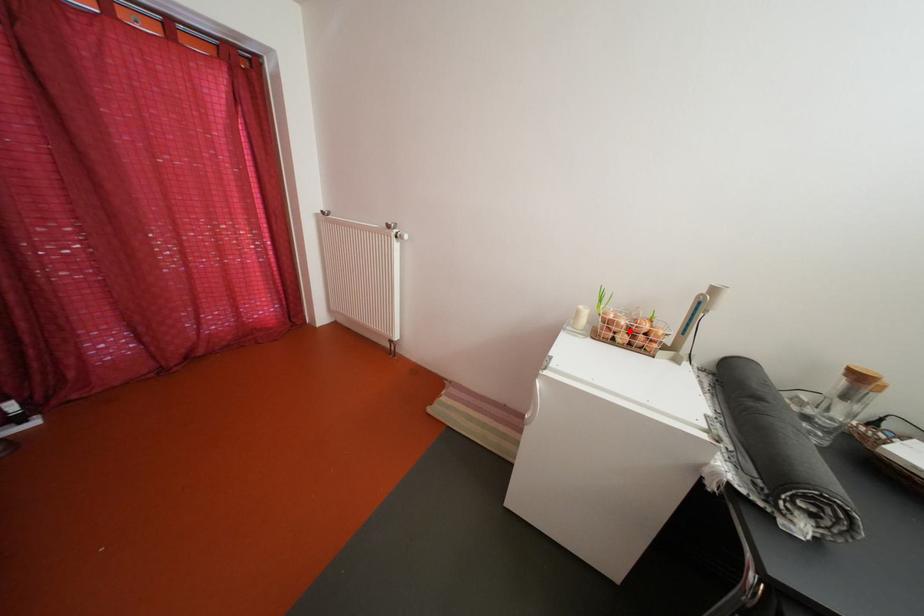
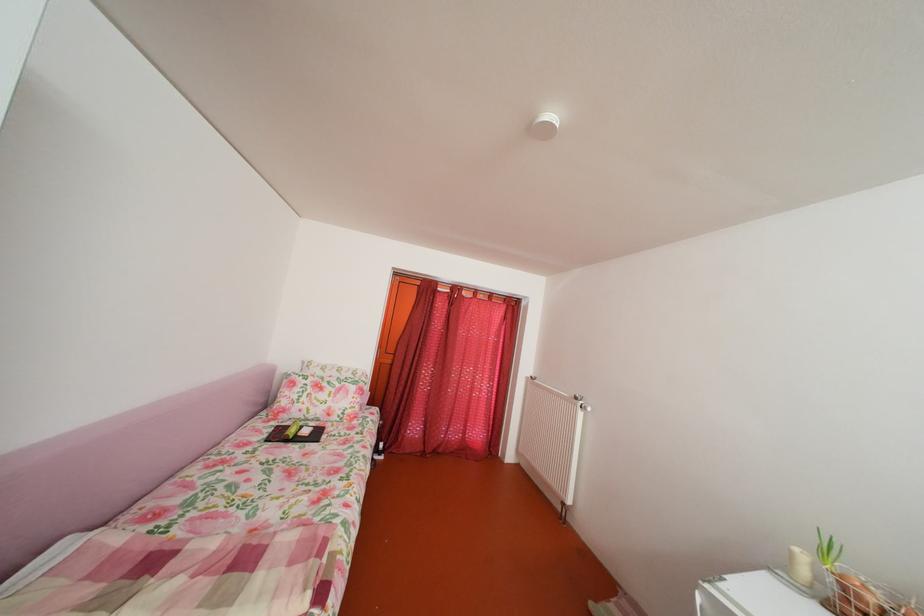
Question: I am providing you with two images of the same scene from different viewpoints. Image1 has a red point marked. In image2, the corresponding 3D location appears at what relative position? Reply with the corresponding letter.

Choices:
 (A) Closer
 (B) Farther

Answer: (A)